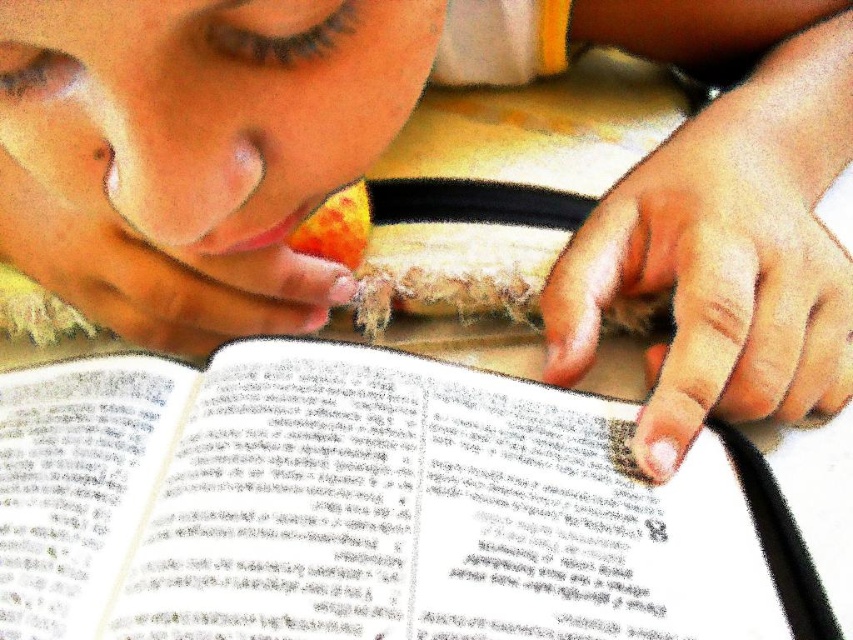
Question: Which is farther from the white paper book at center?

Choices:
 (A) smooth skin hand at lower right
 (B) smooth skin hand at center

Answer: (A)

Question: Is white paper book at center below smooth skin hand at lower right?

Choices:
 (A) yes
 (B) no

Answer: (A)

Question: Can you confirm if smooth skin hand at lower right is positioned below smooth skin hand at center?

Choices:
 (A) no
 (B) yes

Answer: (B)

Question: Can you confirm if white paper book at center is positioned to the right of smooth skin hand at center?

Choices:
 (A) yes
 (B) no

Answer: (A)

Question: Which object is positioned closest to the white paper book at center?

Choices:
 (A) smooth skin hand at center
 (B) smooth skin hand at lower right

Answer: (A)

Question: Which object is positioned closest to the white paper book at center?

Choices:
 (A) smooth skin hand at center
 (B) smooth skin hand at lower right

Answer: (A)